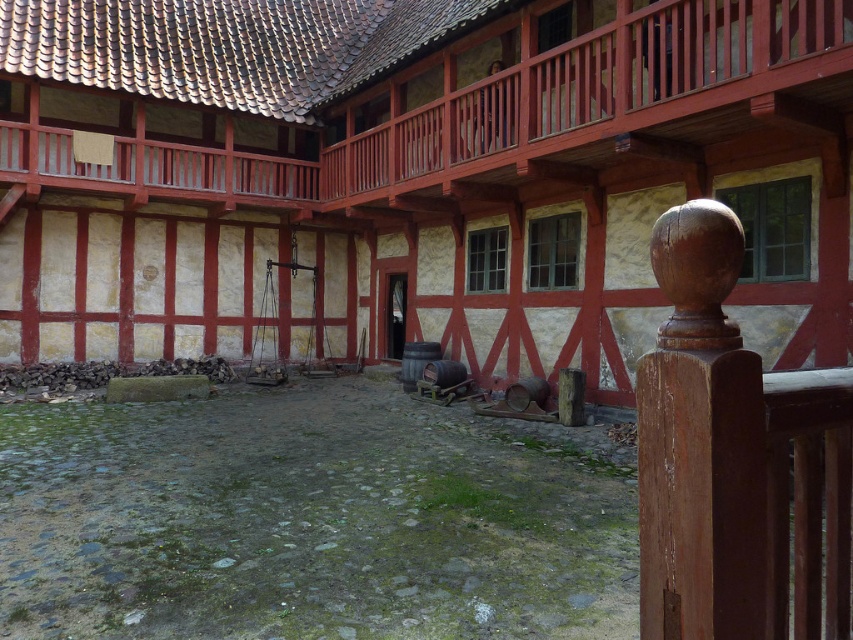
Can you confirm if wooden balcony at upper center is positioned to the left of wooden post at lower right?

Yes, wooden balcony at upper center is to the left of wooden post at lower right.

Locate an element on the screen. This screenshot has height=640, width=853. wooden balcony at upper center is located at coordinates (395, 84).

Locate an element on the screen. The width and height of the screenshot is (853, 640). wooden balcony at upper center is located at coordinates (395, 84).